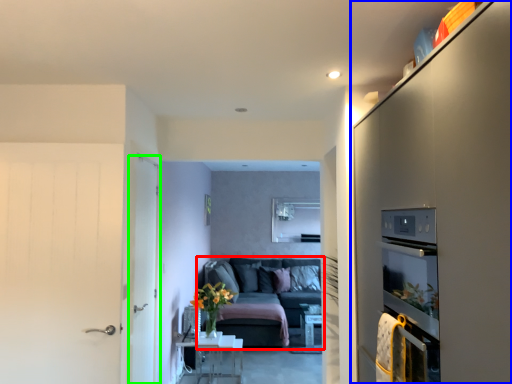
Question: Which is farther away from studio couch (highlighted by a red box)? cabinetry (highlighted by a blue box) or door (highlighted by a green box)?

Choices:
 (A) cabinetry
 (B) door

Answer: (A)